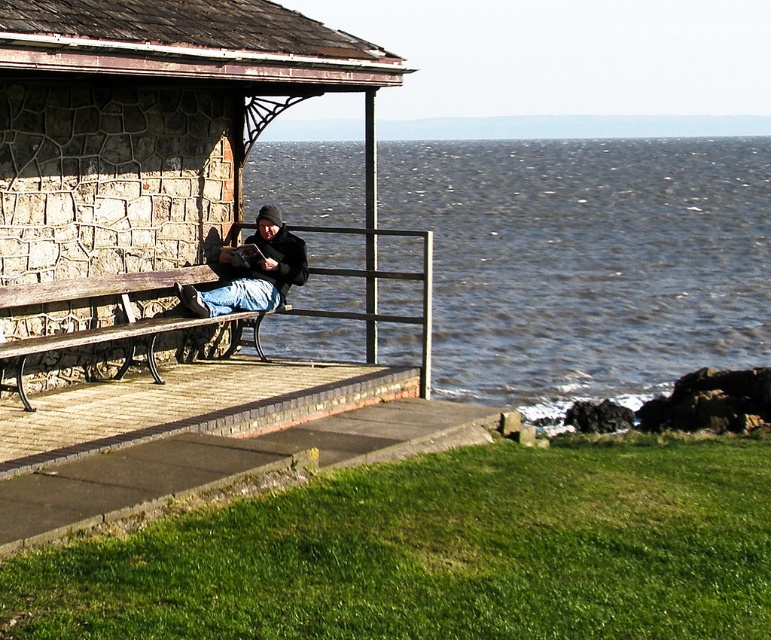
Question: Which of the following is the farthest from the observer?

Choices:
 (A) (180, 13)
 (B) (248, 259)
 (C) (200, 316)

Answer: (B)

Question: Which of the following is the closest to the observer?

Choices:
 (A) (483, 273)
 (B) (123, 19)

Answer: (B)

Question: Is the position of dark blue water at center more distant than that of jeans at center?

Choices:
 (A) yes
 (B) no

Answer: (A)

Question: Among these points, which one is farthest from the camera?

Choices:
 (A) (224, 17)
 (B) (288, 250)

Answer: (B)

Question: Can you confirm if dark blue water at center is wider than jeans at center?

Choices:
 (A) yes
 (B) no

Answer: (A)

Question: Is stone textured bench at left above jeans at center?

Choices:
 (A) no
 (B) yes

Answer: (B)